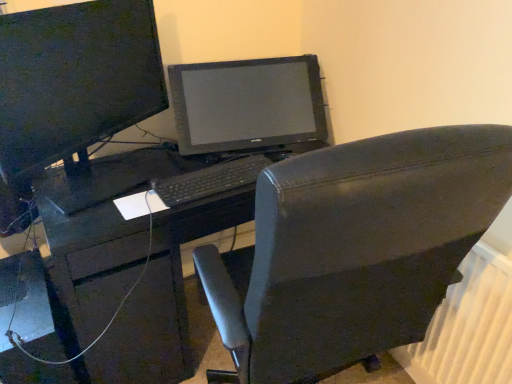
At what (x,y) coordinates should I click in order to perform the action: click on vacant point above matte black desk at center (from a real-world perspective). Please return your answer as a coordinate pair (x, y). Looking at the image, I should click on (169, 169).